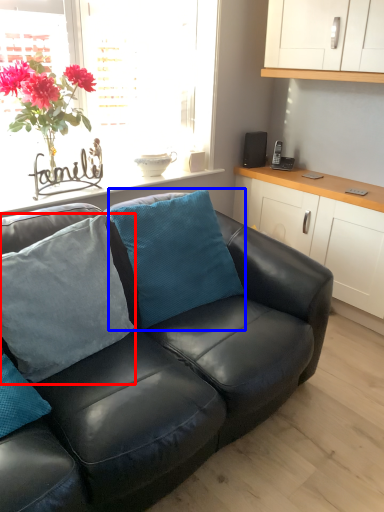
Question: Which of the following is the closest to the observer, pillow (highlighted by a red box) or pillow (highlighted by a blue box)?

Choices:
 (A) pillow
 (B) pillow

Answer: (A)